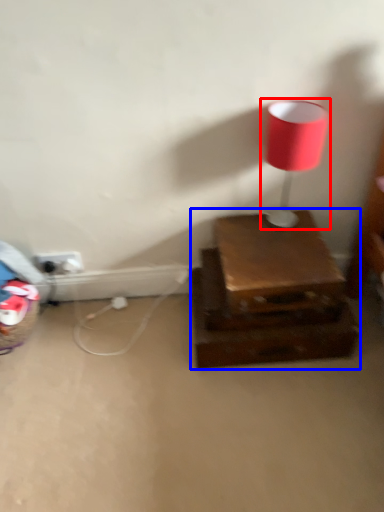
Question: Which object appears closest to the camera in this image, lamp (highlighted by a red box) or furniture (highlighted by a blue box)?

Choices:
 (A) lamp
 (B) furniture

Answer: (A)